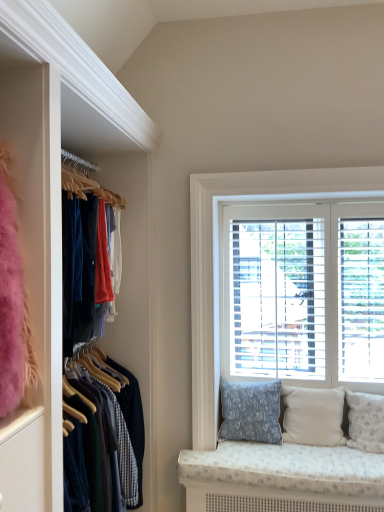
Question: From the image's perspective, would you say beige fabric pillow at lower right, positioned as the 2th pillow in right-to-left order, is positioned over white fabric pillow at lower right, acting as the first pillow starting from the right?

Choices:
 (A) no
 (B) yes

Answer: (B)

Question: Would you say beige fabric pillow at lower right, placed as the 2th pillow when sorted from left to right, is a long distance from white fabric pillow at lower right, acting as the first pillow starting from the right?

Choices:
 (A) no
 (B) yes

Answer: (A)

Question: Is white fabric pillow at lower right, acting as the first pillow starting from the right, surrounded by beige fabric pillow at lower right, placed as the 2th pillow when sorted from left to right?

Choices:
 (A) yes
 (B) no

Answer: (B)

Question: Is beige fabric pillow at lower right, positioned as the 2th pillow in right-to-left order, shorter than white fabric pillow at lower right, positioned as the 3th pillow in left-to-right order?

Choices:
 (A) no
 (B) yes

Answer: (B)

Question: Is beige fabric pillow at lower right, placed as the 2th pillow when sorted from left to right, in front of white fabric pillow at lower right, positioned as the 3th pillow in left-to-right order?

Choices:
 (A) yes
 (B) no

Answer: (B)

Question: Would you say beige fabric pillow at lower right, placed as the 2th pillow when sorted from left to right, is outside white fabric pillow at lower right, acting as the first pillow starting from the right?

Choices:
 (A) yes
 (B) no

Answer: (A)

Question: Considering the relative positions of blue floral fabric pillow at lower right, which is counted as the 3th pillow, starting from the right, and white wood blinds at upper right in the image provided, is blue floral fabric pillow at lower right, which is counted as the 3th pillow, starting from the right, in front of white wood blinds at upper right?

Choices:
 (A) yes
 (B) no

Answer: (A)

Question: From the image's perspective, is blue floral fabric pillow at lower right, which is counted as the 3th pillow, starting from the right, located above white wood blinds at upper right?

Choices:
 (A) no
 (B) yes

Answer: (A)

Question: Can you confirm if blue floral fabric pillow at lower right, which is counted as the 3th pillow, starting from the right, is taller than white wood blinds at upper right?

Choices:
 (A) yes
 (B) no

Answer: (B)

Question: Can you confirm if blue floral fabric pillow at lower right, which is counted as the 3th pillow, starting from the right, is positioned to the left of white wood blinds at upper right?

Choices:
 (A) yes
 (B) no

Answer: (A)

Question: Is blue floral fabric pillow at lower right, marked as the first pillow in a left-to-right arrangement, smaller than white wood blinds at upper right?

Choices:
 (A) yes
 (B) no

Answer: (A)

Question: Is blue floral fabric pillow at lower right, which is counted as the 3th pillow, starting from the right, bigger than white wood blinds at upper right?

Choices:
 (A) yes
 (B) no

Answer: (B)

Question: Considering the relative sizes of blue floral fabric pillow at lower right, which is counted as the 3th pillow, starting from the right, and beige fabric pillow at lower right, placed as the 2th pillow when sorted from left to right, in the image provided, is blue floral fabric pillow at lower right, which is counted as the 3th pillow, starting from the right, thinner than beige fabric pillow at lower right, placed as the 2th pillow when sorted from left to right,?

Choices:
 (A) no
 (B) yes

Answer: (A)